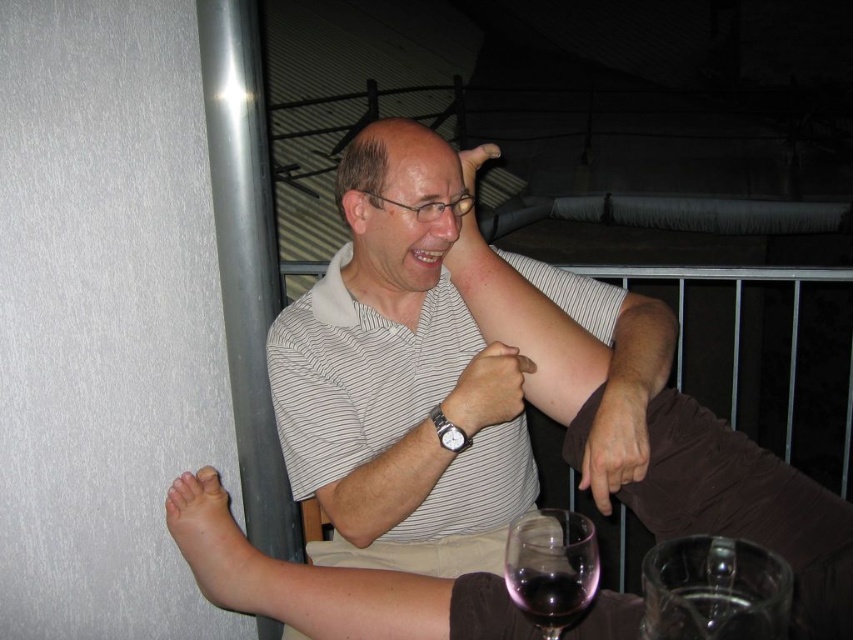
Question: Is transparent glass at lower center below matte striped shirt at center?

Choices:
 (A) no
 (B) yes

Answer: (B)

Question: Which point is closer to the camera?

Choices:
 (A) pyautogui.click(x=497, y=396)
 (B) pyautogui.click(x=550, y=593)
 (C) pyautogui.click(x=317, y=301)
 (D) pyautogui.click(x=531, y=616)

Answer: (B)

Question: Which of the following is the closest to the observer?

Choices:
 (A) striped cotton shirt at center
 (B) silver metallic watch at center

Answer: (A)

Question: Considering the real-world distances, which object is closest to the matte striped shirt at center?

Choices:
 (A) striped cotton shirt at center
 (B) transparent glass at lower right
 (C) transparent glass at lower center

Answer: (A)

Question: Observing the image, what is the correct spatial positioning of matte striped shirt at center in reference to silver metallic watch at center?

Choices:
 (A) below
 (B) above

Answer: (B)

Question: Is transparent glass at lower right positioned behind silver metallic watch at center?

Choices:
 (A) yes
 (B) no

Answer: (B)